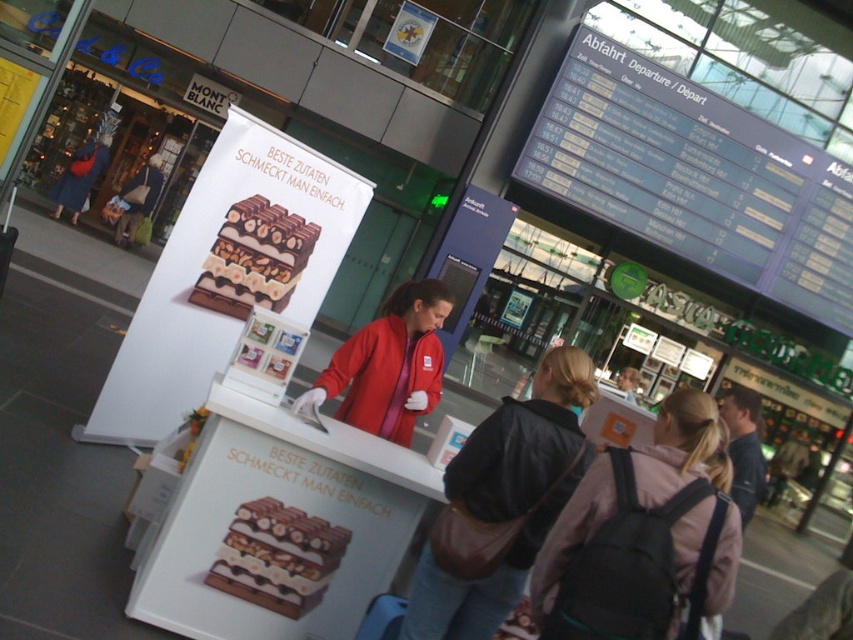
Which of these two, matte chocolate cake at center or chocolatesmoothchocolate bar at center, stands shorter?

Standing shorter between the two is matte chocolate cake at center.

Which of these two, matte chocolate cake at center or chocolatesmoothchocolate bar at center, stands taller?

chocolatesmoothchocolate bar at center is taller.

The width and height of the screenshot is (853, 640). Identify the location of matte chocolate cake at center. (277, 556).

The height and width of the screenshot is (640, 853). What are the coordinates of `matte chocolate cake at center` in the screenshot? It's located at (277, 556).

Image resolution: width=853 pixels, height=640 pixels. What do you see at coordinates (642, 538) in the screenshot?
I see `pink fabric backpack at center` at bounding box center [642, 538].

Between pink fabric backpack at center and matte chocolate cake at center, which one is positioned lower?

matte chocolate cake at center is below.

Locate an element on the screen. pink fabric backpack at center is located at coordinates (642, 538).

How distant is dark gray leather jacket at center from matte red jacket at center?

dark gray leather jacket at center is 3.45 feet away from matte red jacket at center.

Who is positioned more to the left, dark gray leather jacket at center or matte red jacket at center?

matte red jacket at center is more to the left.

Does point (563, 500) come in front of point (309, 403)?

That is True.

What are the coordinates of `dark gray leather jacket at center` in the screenshot? It's located at (506, 499).